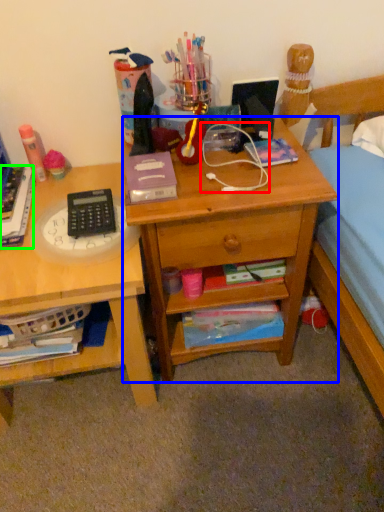
Question: Estimate the real-world distances between objects in this image. Which object is farther from twin (highlighted by a red box), desk (highlighted by a blue box) or book (highlighted by a green box)?

Choices:
 (A) desk
 (B) book

Answer: (B)